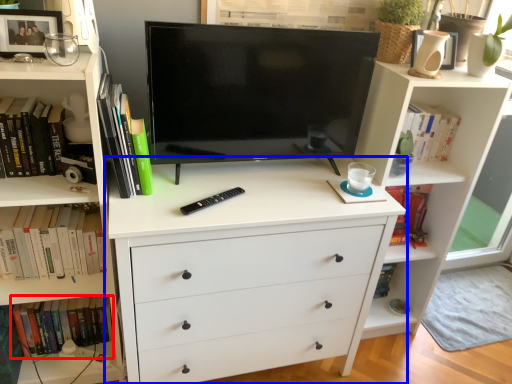
Question: Which point is closer to the camera, book (highlighted by a red box) or chest of drawers (highlighted by a blue box)?

Choices:
 (A) book
 (B) chest of drawers

Answer: (B)